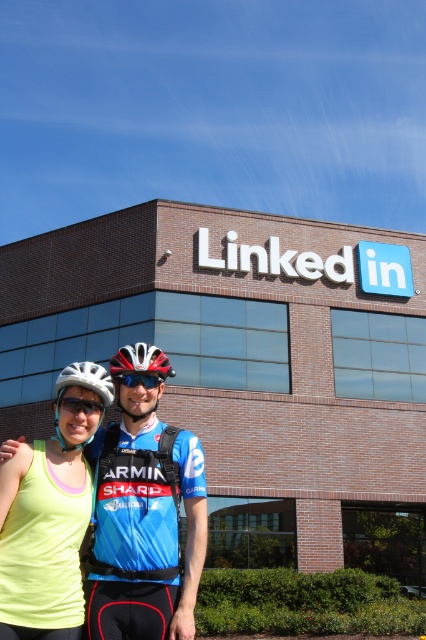
Between blue jersey at center and clear plastic goggles at center, which one appears on the right side from the viewer's perspective?

blue jersey at center

Which is in front, point (143, 554) or point (66, 406)?

Point (143, 554) is more forward.

The width and height of the screenshot is (426, 640). Describe the element at coordinates (143, 524) in the screenshot. I see `blue jersey at center` at that location.

I want to click on blue jersey at center, so 143,524.

The height and width of the screenshot is (640, 426). Find the location of `red matte helmet at center`. red matte helmet at center is located at coordinates click(x=140, y=365).

You are a GUI agent. You are given a task and a screenshot of the screen. Output one action in this format:
    pyautogui.click(x=<x>, y=<y>)
    Task: Click on the red matte helmet at center
    The width and height of the screenshot is (426, 640).
    Given the screenshot: What is the action you would take?
    pyautogui.click(x=140, y=365)

Measure the distance between blue jersey at center and camera.

blue jersey at center and camera are 4.90 meters apart from each other.

Is blue jersey at center below shiny red helmet at center?

Indeed, blue jersey at center is positioned under shiny red helmet at center.

Between point (101, 564) and point (169, 372), which one is positioned behind?

The point (169, 372) is more distant.

Where is `blue jersey at center`? blue jersey at center is located at coordinates (143, 524).